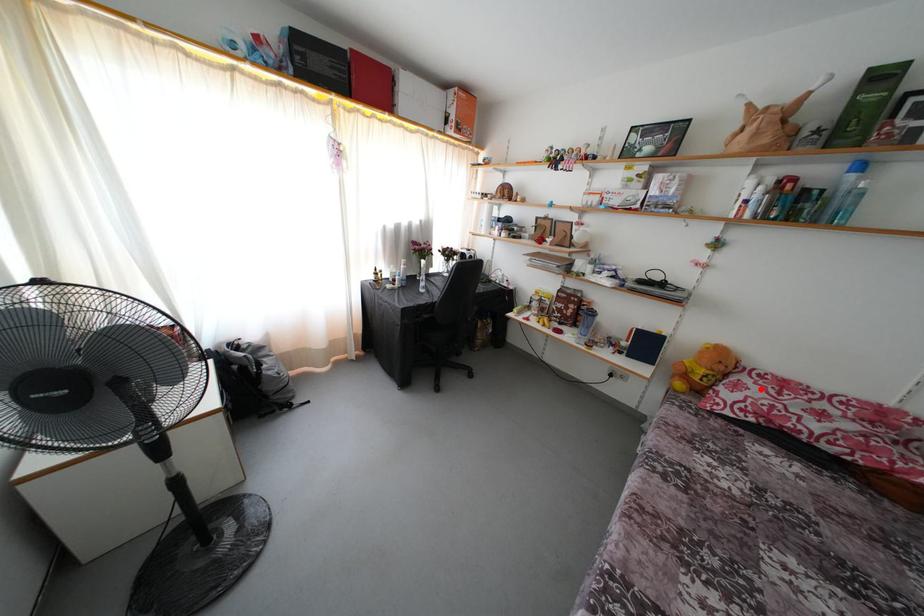
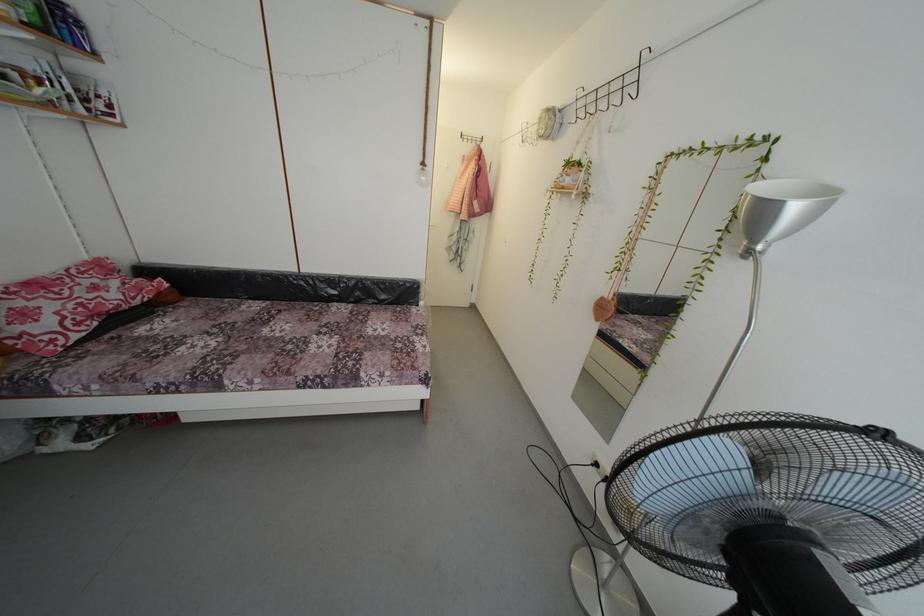
Locate, in the second image, the point that corresponds to the highlighted location in the first image.

(34, 306)